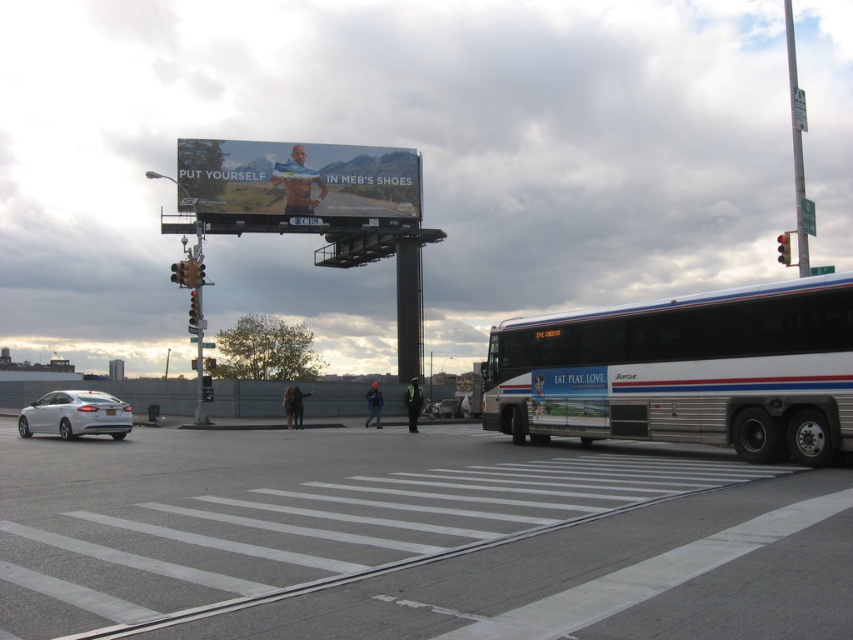
Question: Considering the relative positions of matte plastic billboard at upper center and metallic silver sedan at center in the image provided, where is matte plastic billboard at upper center located with respect to metallic silver sedan at center?

Choices:
 (A) left
 (B) right

Answer: (A)

Question: Which of the following is the farthest from the observer?

Choices:
 (A) (451, 404)
 (B) (68, 400)
 (C) (495, 339)
 (D) (206, 368)

Answer: (A)

Question: Among these objects, which one is nearest to the camera?

Choices:
 (A) white glossy sedan at lower left
 (B) metallic yellow traffic light at upper center
 (C) metallic traffic light at left

Answer: (A)

Question: Which is farther from the metallic silver sedan at center?

Choices:
 (A) red glass traffic light at upper right
 (B) white metallic bus at center-right
 (C) white glossy sedan at lower left

Answer: (A)

Question: Observing the image, what is the correct spatial positioning of white metallic bus at center-right in reference to white glossy sedan at lower left?

Choices:
 (A) left
 (B) right

Answer: (B)

Question: Is matte plastic billboard at upper center thinner than red glass traffic light at upper right?

Choices:
 (A) no
 (B) yes

Answer: (B)